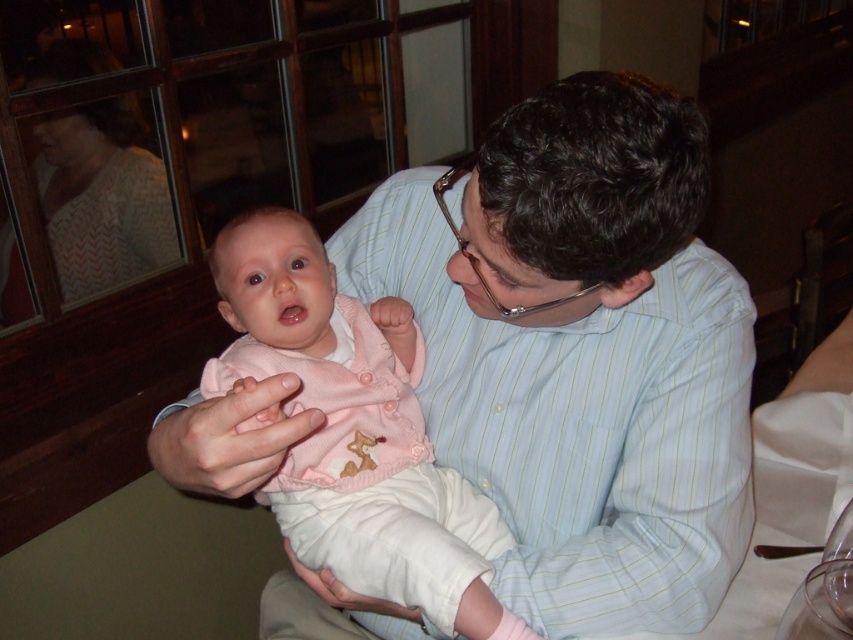
Question: Does light blue striped shirt at center lie in front of pink knitted sweater at center?

Choices:
 (A) yes
 (B) no

Answer: (A)

Question: Which point appears closest to the camera in this image?

Choices:
 (A) (399, 344)
 (B) (549, 454)

Answer: (B)

Question: Does light blue striped shirt at center have a smaller size compared to pink knitted sweater at center?

Choices:
 (A) yes
 (B) no

Answer: (B)

Question: Which point appears farthest from the camera in this image?

Choices:
 (A) (253, 294)
 (B) (612, 125)

Answer: (A)

Question: Where is light blue striped shirt at center located in relation to pink knitted sweater at center in the image?

Choices:
 (A) below
 (B) above

Answer: (B)